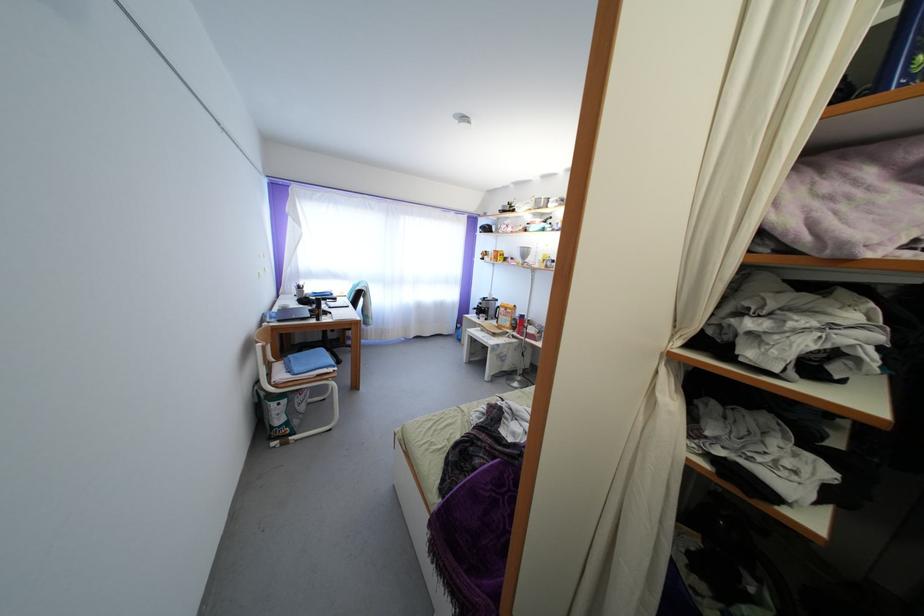
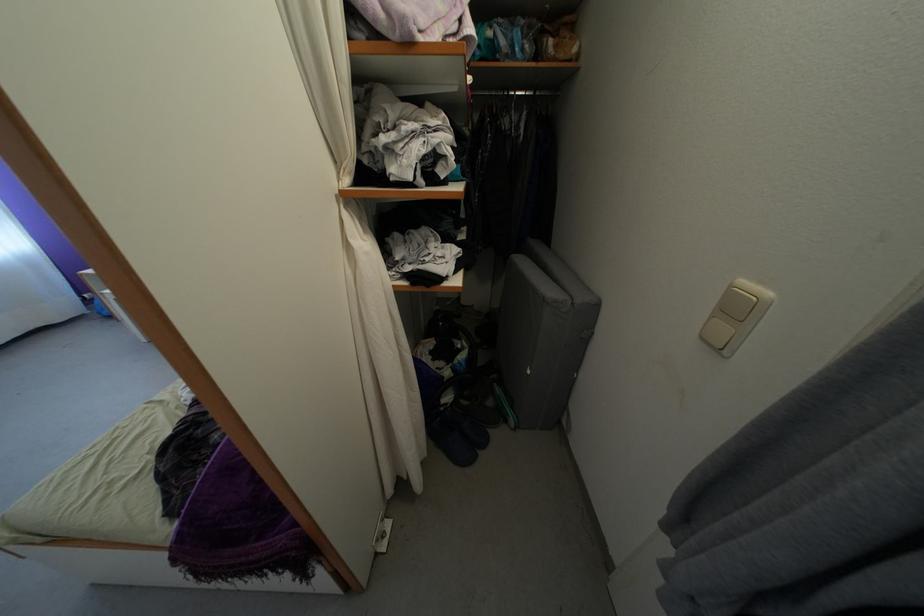
Where in the second image is the point corresponding to (663,400) from the first image?

(356, 246)